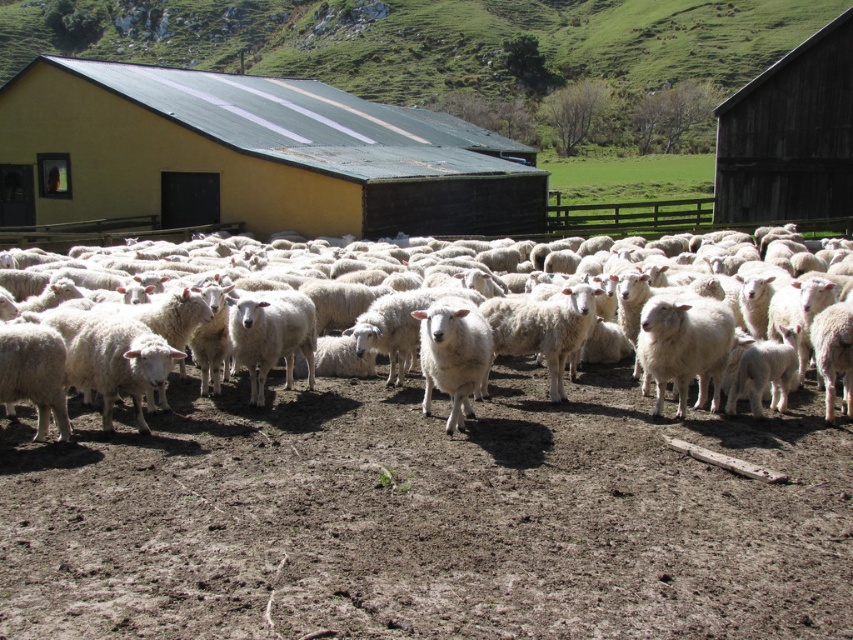
Is yellow matte barn at center to the right of white woolly sheep at center from the viewer's perspective?

Incorrect, yellow matte barn at center is not on the right side of white woolly sheep at center.

Which of these two, yellow matte barn at center or white woolly sheep at center, stands taller?

yellow matte barn at center

The image size is (853, 640). I want to click on yellow matte barn at center, so click(248, 156).

Between yellow matte barn at center and dark brown wooden barn at upper right, which one has more height?

With more height is yellow matte barn at center.

Who is higher up, yellow matte barn at center or dark brown wooden barn at upper right?

Positioned higher is yellow matte barn at center.

Who is more distant from viewer, (x=364, y=129) or (x=759, y=147)?

The point (x=364, y=129) is behind.

Locate an element on the screen. This screenshot has width=853, height=640. yellow matte barn at center is located at coordinates (248, 156).

Can you confirm if white woolly sheep at center is positioned to the left of dark brown wooden barn at upper right?

Indeed, white woolly sheep at center is positioned on the left side of dark brown wooden barn at upper right.

Does white woolly sheep at center have a larger size compared to dark brown wooden barn at upper right?

No, white woolly sheep at center is not bigger than dark brown wooden barn at upper right.

Is point (457, 289) more distant than point (791, 150)?

No, (457, 289) is in front of (791, 150).

Where is `white woolly sheep at center`? This screenshot has width=853, height=640. white woolly sheep at center is located at coordinates (349, 323).